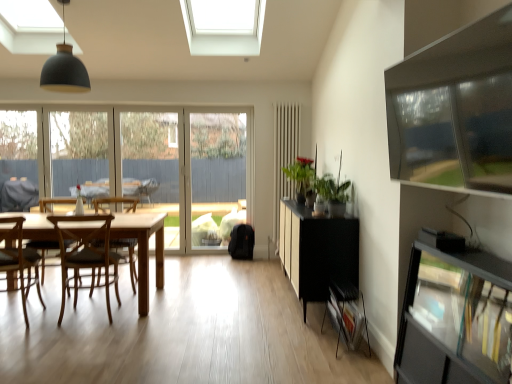
Question: From the image's perspective, is clear glass door at center above or below wooden chair at center, which appears as the 1th chair when viewed from the back?

Choices:
 (A) above
 (B) below

Answer: (A)

Question: Is clear glass door at center wider or thinner than wooden chair at center, acting as the third chair starting from the front?

Choices:
 (A) thin
 (B) wide

Answer: (A)

Question: Considering the real-world distances, which object is closest to the transparent glass window screen at upper right?

Choices:
 (A) matte black pendant lamp at upper left
 (B) clear glass door at center
 (C) light brown wooden table at left
 (D) wooden chair at left, the third chair when ordered from back to front
 (E) white textured radiator at center

Answer: (C)

Question: Estimate the real-world distances between objects in this image. Which object is farther from the white textured radiator at center?

Choices:
 (A) clear glass window frame at left, the 2th window frame viewed from the right
 (B) light brown wooden table at left
 (C) matte black pendant lamp at upper left
 (D) wooden chair at center, which appears as the 1th chair when viewed from the back
 (E) clear glass door at center

Answer: (A)